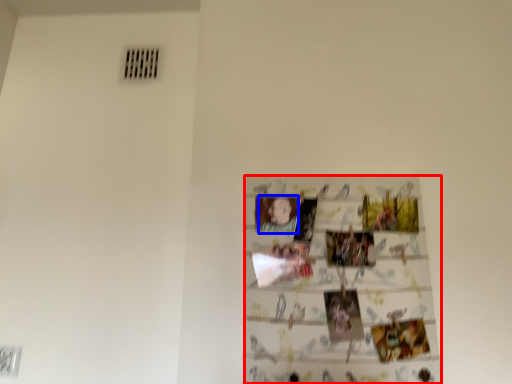
Question: Which object appears closest to the camera in this image, print (highlighted by a red box) or person (highlighted by a blue box)?

Choices:
 (A) print
 (B) person

Answer: (A)